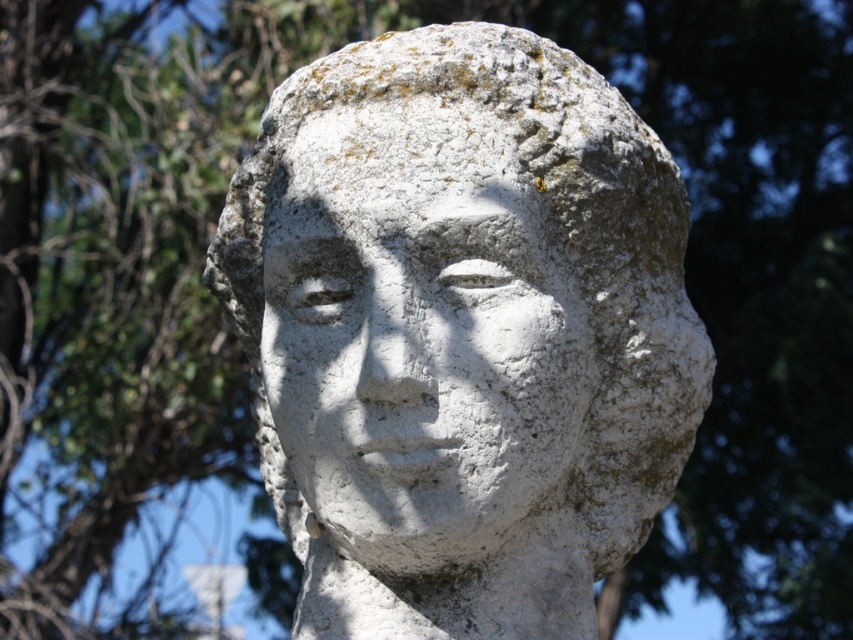
You are an art conservator examining a weathered stone sculpture. You notice two distinct areas on the sculpture labeled as the white stone bust at center and the white stone face at center. Given their proximity, could there be a possibility that these two areas are actually part of the same structure? Please explain based on their distance.

The white stone bust at center is only 1.28 inches away from the white stone face at center. This close proximity suggests that they are likely part of the same structure, as the distance between them is minimal and consistent with typical sculptural composition where the bust and face are integral components of a single figure.

You are standing in front of a stone bust in a garden. The coordinates of the white stone bust at center are given as point (x=461, y=332). If you want to place a small flower pot 0.1 units to the right of the white stone bust at center, what would be the new coordinates for the flower pot?

The new coordinates for the flower pot would be 0.619, 0.542.

From the picture: You are standing in front of the image and want to locate the white stone bust at center. What are the coordinates of its position?

The white stone bust at center is located at coordinates point [461,332].